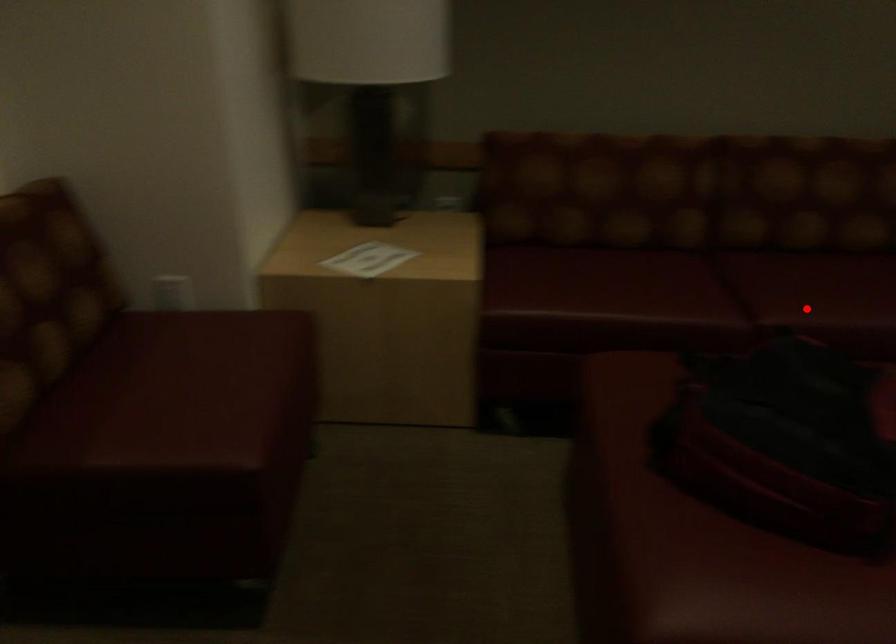
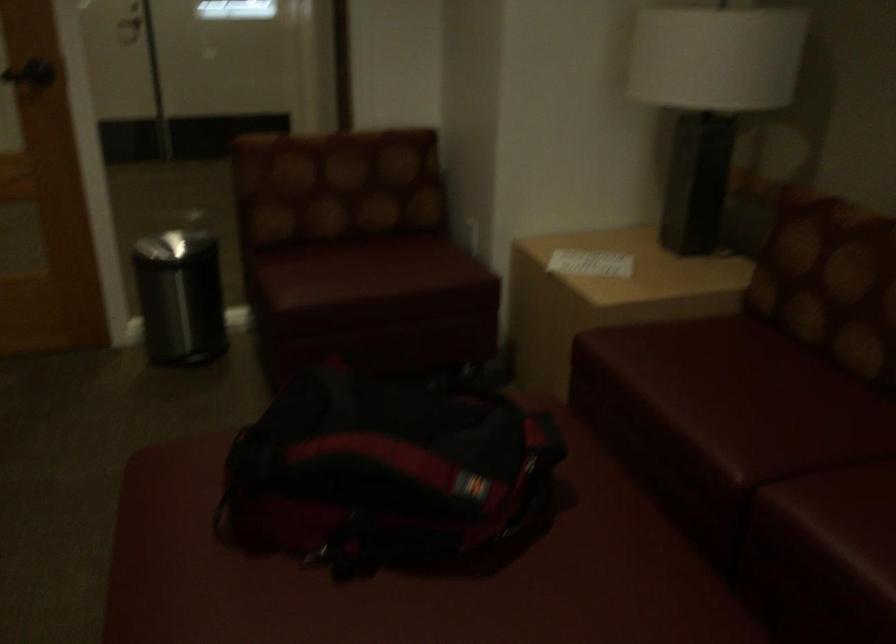
Question: A red point is marked in image1. In image2, is the corresponding 3D point closer to the camera or farther? Reply with the corresponding letter.

Choices:
 (A) The corresponding 3D point is closer.
 (B) The corresponding 3D point is farther.

Answer: (A)